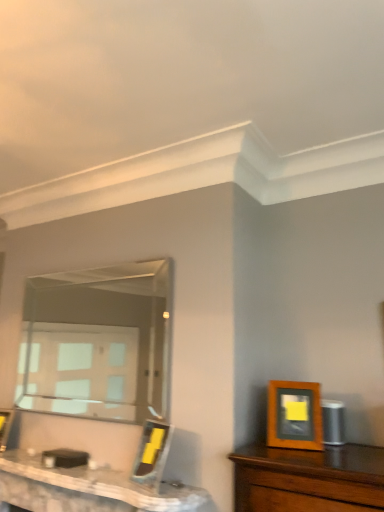
Image resolution: width=384 pixels, height=512 pixels. I want to click on clear glass mirror at center, so click(98, 342).

The image size is (384, 512). What do you see at coordinates (5, 426) in the screenshot? I see `wooden picture frame at center, the 3th picture frame when ordered from right to left` at bounding box center [5, 426].

From the picture: How much space does wooden picture frame at center, which is the third picture frame in front-to-back order, occupy horizontally?

5.59 inches.

I want to click on wooden picture frame at right, which is the first picture frame in right-to-left order, so click(294, 415).

Image resolution: width=384 pixels, height=512 pixels. I want to click on white marble table at lower left, so click(x=87, y=489).

In the image, is white marble table at lower left positioned in front of or behind clear glass mirror at center?

white marble table at lower left is in front of clear glass mirror at center.

Which object is thinner, white marble table at lower left or clear glass mirror at center?

clear glass mirror at center is thinner.

Based on the photo, can you confirm if white marble table at lower left is shorter than clear glass mirror at center?

Correct, white marble table at lower left is not as tall as clear glass mirror at center.

Is point (65, 473) positioned before point (48, 318)?

Yes, point (65, 473) is closer to viewer.

Could you tell me if white marble table at lower left is turned towards wooden picture frame at center, the 2th picture frame in the back-to-front sequence?

No.

Considering the positions of objects white marble table at lower left and wooden picture frame at center, the 2th picture frame in the back-to-front sequence, in the image provided, who is behind, white marble table at lower left or wooden picture frame at center, the 2th picture frame in the back-to-front sequence,?

Positioned behind is wooden picture frame at center, the 2th picture frame in the back-to-front sequence.

Is white marble table at lower left wider or thinner than wooden picture frame at center, the 2th picture frame in the back-to-front sequence?

Clearly, white marble table at lower left has more width compared to wooden picture frame at center, the 2th picture frame in the back-to-front sequence.

From the image's perspective, is white marble table at lower left above wooden picture frame at center, which is counted as the 2th picture frame, starting from the left?

No.

From the image's perspective, which is above, wooden picture frame at center, placed as the second picture frame when sorted from right to left, or clear glass mirror at center?

clear glass mirror at center.

Is wooden picture frame at center, which is counted as the 2th picture frame, starting from the left, taller than clear glass mirror at center?

No, wooden picture frame at center, which is counted as the 2th picture frame, starting from the left, is not taller than clear glass mirror at center.

Between wooden picture frame at center, the 2th picture frame in the back-to-front sequence, and clear glass mirror at center, which one appears on the right side from the viewer's perspective?

From the viewer's perspective, wooden picture frame at center, the 2th picture frame in the back-to-front sequence, appears more on the right side.

From the picture: From a real-world perspective, is wooden picture frame at center, placed as the second picture frame when sorted from right to left, physically above wooden picture frame at right, which is the 3th picture frame from back to front?

No, from a real-world perspective, wooden picture frame at center, placed as the second picture frame when sorted from right to left, is not over wooden picture frame at right, which is the 3th picture frame from back to front

Considering the relative sizes of wooden picture frame at center, the 2th picture frame from the front, and wooden picture frame at right, which is the first picture frame in right-to-left order, in the image provided, is wooden picture frame at center, the 2th picture frame from the front, shorter than wooden picture frame at right, which is the first picture frame in right-to-left order,?

No, wooden picture frame at center, the 2th picture frame from the front, is not shorter than wooden picture frame at right, which is the first picture frame in right-to-left order.

Consider the image. Is wooden picture frame at center, the 2th picture frame in the back-to-front sequence, positioned before wooden picture frame at right, which is the 3th picture frame from back to front?

No, it is behind wooden picture frame at right, which is the 3th picture frame from back to front.

Which point is more distant from viewer, (58,370) or (134,502)?

Positioned behind is point (58,370).

The width and height of the screenshot is (384, 512). In order to click on table in front of the clear glass mirror at center in this screenshot , I will do `click(87, 489)`.

Is clear glass mirror at center not near white marble table at lower left?

Yes, clear glass mirror at center and white marble table at lower left are located far from each other.

From the image's perspective, starting from the wooden picture frame at center, which is the first picture frame in left-to-right order, which picture frame is the 2nd one above? Please provide its 2D coordinates.

[(294, 415)]

Considering the relative sizes of wooden picture frame at right, which is the first picture frame in right-to-left order, and wooden picture frame at center, which is the third picture frame in front-to-back order, in the image provided, is wooden picture frame at right, which is the first picture frame in right-to-left order, wider than wooden picture frame at center, which is the third picture frame in front-to-back order,?

No.

From the image's perspective, which one is positioned lower, wooden picture frame at right, which ranks as the 3th picture frame in left-to-right order, or wooden picture frame at center, arranged as the first picture frame when viewed from the back?

wooden picture frame at center, arranged as the first picture frame when viewed from the back.

Is wooden picture frame at right, which is the first picture frame in right-to-left order, further to the viewer compared to wooden picture frame at center, which is the third picture frame in front-to-back order?

No, wooden picture frame at right, which is the first picture frame in right-to-left order, is in front of wooden picture frame at center, which is the third picture frame in front-to-back order.

You are a GUI agent. You are given a task and a screenshot of the screen. Output one action in this format:
    pyautogui.click(x=<x>, y=<y>)
    Task: Click on the 1st picture frame below the clear glass mirror at center (from a real-world perspective)
    The width and height of the screenshot is (384, 512).
    Given the screenshot: What is the action you would take?
    pyautogui.click(x=294, y=415)

Is clear glass mirror at center bigger or smaller than wooden picture frame at right, which is the 3th picture frame from back to front?

In the image, clear glass mirror at center appears to be larger than wooden picture frame at right, which is the 3th picture frame from back to front.

Which object is positioned more to the left, clear glass mirror at center or wooden picture frame at right, which is the first picture frame in right-to-left order?

Positioned to the left is clear glass mirror at center.

I want to click on mirror that appears above the white marble table at lower left (from the image's perspective), so click(98, 342).

Which picture frame is the 1st one when counting from the right side of the white marble table at lower left? Please provide its 2D coordinates.

[(152, 453)]

Looking at this image, which object lies further to the anchor point clear glass mirror at center, white marble table at lower left or wooden picture frame at center, arranged as the first picture frame when viewed from the back?

Among the two, white marble table at lower left is located further to clear glass mirror at center.

Looking at the image, which one is located closer to wooden picture frame at right, which is the first picture frame in right-to-left order, wooden picture frame at center, which is the third picture frame in front-to-back order, or clear glass mirror at center?

Based on the image, wooden picture frame at center, which is the third picture frame in front-to-back order, appears to be nearer to wooden picture frame at right, which is the first picture frame in right-to-left order.

From the image, which object appears to be nearer to clear glass mirror at center, wooden picture frame at right, which ranks as the 3th picture frame in left-to-right order, or white marble table at lower left?

white marble table at lower left is positioned closer to the anchor clear glass mirror at center.

Estimate the real-world distances between objects in this image. Which object is closer to clear glass mirror at center, wooden picture frame at center, which is the first picture frame in left-to-right order, or white marble table at lower left?

wooden picture frame at center, which is the first picture frame in left-to-right order, lies closer to clear glass mirror at center than the other object.

Which object lies nearer to the anchor point clear glass mirror at center, wooden picture frame at center, the 3th picture frame when ordered from right to left, or wooden picture frame at center, which is counted as the 2th picture frame, starting from the left?

wooden picture frame at center, the 3th picture frame when ordered from right to left, is positioned closer to the anchor clear glass mirror at center.

Considering their positions, is clear glass mirror at center positioned closer to wooden picture frame at center, which is the third picture frame in front-to-back order, than wooden picture frame at right, which is the first picture frame in right-to-left order?

The object closer to wooden picture frame at center, which is the third picture frame in front-to-back order, is wooden picture frame at right, which is the first picture frame in right-to-left order.

Estimate the real-world distances between objects in this image. Which object is further from wooden picture frame at right, which is the 3th picture frame from back to front, clear glass mirror at center or wooden picture frame at center, which is the third picture frame in front-to-back order?

The object further to wooden picture frame at right, which is the 3th picture frame from back to front, is clear glass mirror at center.

When comparing their distances from white marble table at lower left, does wooden picture frame at center, the 2th picture frame in the back-to-front sequence, or clear glass mirror at center seem further?

Among the two, clear glass mirror at center is located further to white marble table at lower left.

Where is `table between wooden picture frame at center, arranged as the first picture frame when viewed from the back, and wooden picture frame at right, which is the 3th picture frame from back to front, in the horizontal direction`? table between wooden picture frame at center, arranged as the first picture frame when viewed from the back, and wooden picture frame at right, which is the 3th picture frame from back to front, in the horizontal direction is located at coordinates (87, 489).

Where is `mirror located between wooden picture frame at center, which is the third picture frame in front-to-back order, and wooden picture frame at right, which is the first picture frame in right-to-left order, in the left-right direction`? mirror located between wooden picture frame at center, which is the third picture frame in front-to-back order, and wooden picture frame at right, which is the first picture frame in right-to-left order, in the left-right direction is located at coordinates (98, 342).

In order to click on mirror situated between white marble table at lower left and wooden picture frame at right, arranged as the first picture frame when viewed from the front, from left to right in this screenshot , I will do `click(98, 342)`.

You are a GUI agent. You are given a task and a screenshot of the screen. Output one action in this format:
    pyautogui.click(x=<x>, y=<y>)
    Task: Click on the picture frame between clear glass mirror at center and wooden picture frame at right, arranged as the first picture frame when viewed from the front, in the horizontal direction
    Image resolution: width=384 pixels, height=512 pixels.
    Given the screenshot: What is the action you would take?
    pyautogui.click(x=152, y=453)